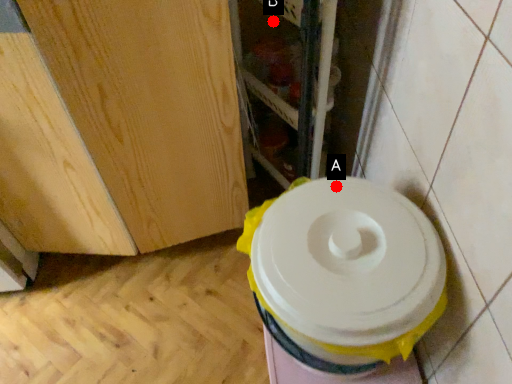
Question: Two points are circled on the image, labeled by A and B beside each circle. Which point is farther to the camera?

Choices:
 (A) A is further
 (B) B is further

Answer: (B)